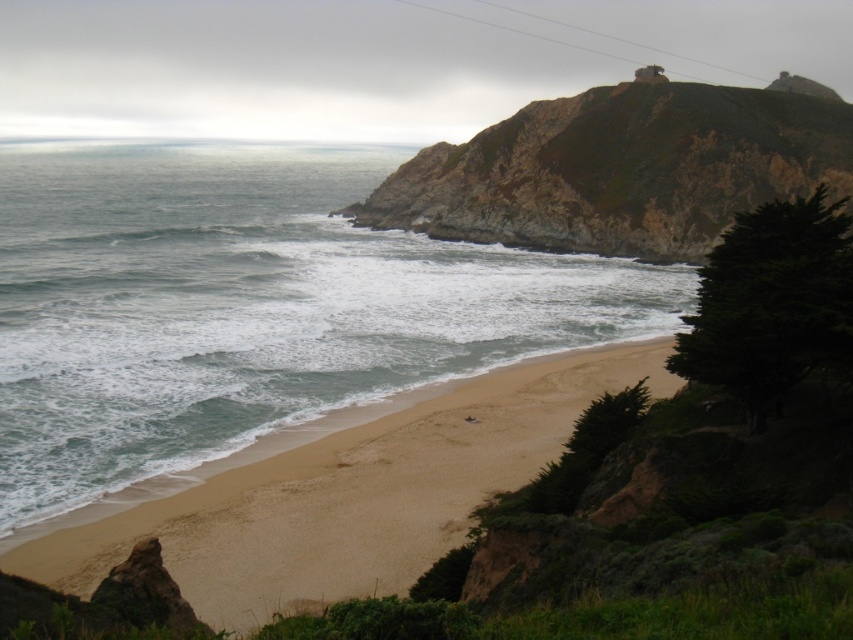
You are standing on the beach and want to walk to the rugged rock cliff at upper right. Which direction should you move relative to the light brown sand at lower center?

You should move upward from the light brown sand at lower center to reach the rugged rock cliff at upper right since the cliff is positioned above the sand in the image.

You are standing at the center of the image and want to walk to the light brown sand at lower center. In which direction should you move?

Since the light brown sand at lower center is located at point (351, 493), you should move towards the lower center direction to reach it.